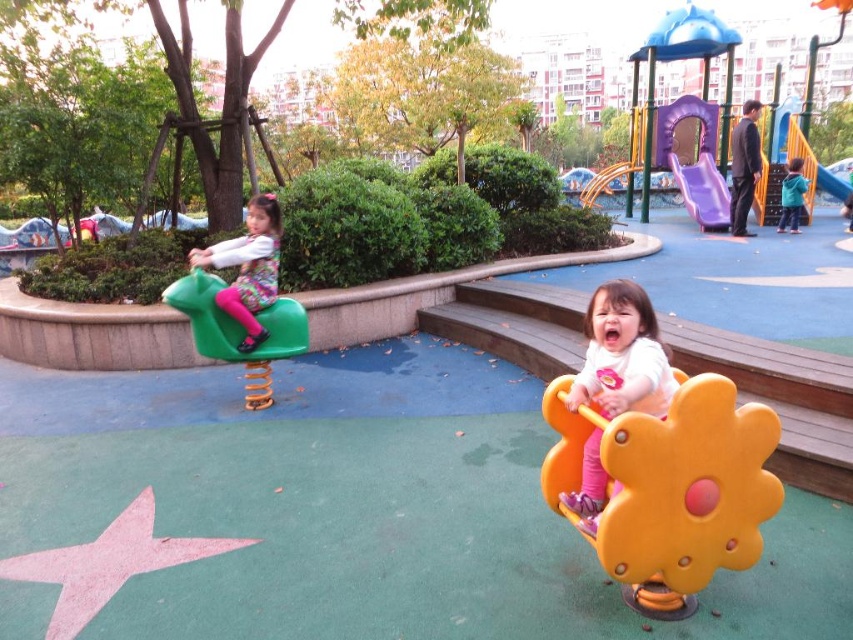
Question: Is matte yellow swing at center to the right of teal matte jacket at right from the viewer's perspective?

Choices:
 (A) yes
 (B) no

Answer: (B)

Question: Considering the real-world distances, which object is farthest from the purple matte slide at upper right?

Choices:
 (A) smooth plastic slide at upper right
 (B) matte yellow swing at center
 (C) green plastic seesaw at left

Answer: (B)

Question: Is orange matte swing at center in front of matte yellow swing at center?

Choices:
 (A) yes
 (B) no

Answer: (A)

Question: Which point appears farthest from the camera in this image?

Choices:
 (A) (202, 284)
 (B) (793, 176)
 (C) (671, 605)
 (D) (648, 371)

Answer: (B)

Question: Among these points, which one is nearest to the camera?

Choices:
 (A) (241, 266)
 (B) (805, 147)
 (C) (706, 570)
 (D) (795, 205)

Answer: (C)

Question: Is the position of matte yellow swing at center less distant than that of purple matte slide at upper right?

Choices:
 (A) yes
 (B) no

Answer: (A)